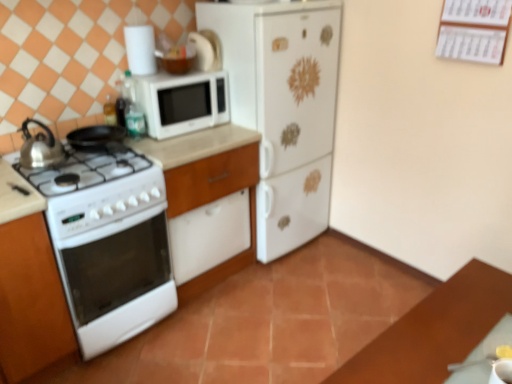
Question: In the image, is white matte refrigerator at center positioned in front of or behind white glossy countertop at lower left?

Choices:
 (A) behind
 (B) front

Answer: (A)

Question: Considering the positions of white matte refrigerator at center and white glossy countertop at lower left in the image, is white matte refrigerator at center wider or thinner than white glossy countertop at lower left?

Choices:
 (A) wide
 (B) thin

Answer: (B)

Question: Which is farther from the white matte refrigerator at center?

Choices:
 (A) white glossy dishwasher at center
 (B) white matte microwave at upper center
 (C) white glossy oven at left
 (D) white paper calendar at upper right
 (E) white glossy countertop at lower left

Answer: (C)

Question: Considering the real-world distances, which object is closest to the white matte microwave at upper center?

Choices:
 (A) shiny metallic kettle at left
 (B) white paper calendar at upper right
 (C) white glossy countertop at lower left
 (D) white matte refrigerator at center
 (E) white glossy dishwasher at center

Answer: (C)